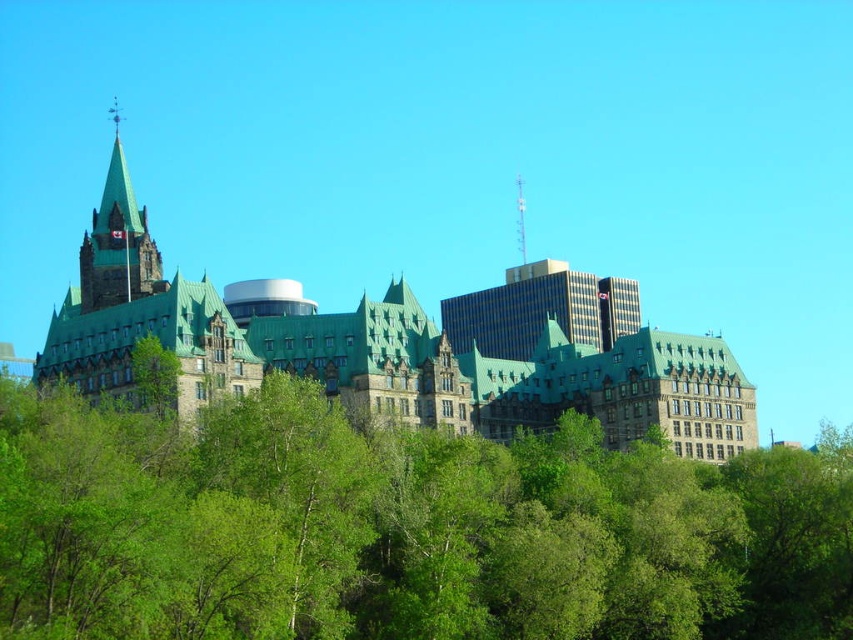
Does green leafy tree at center appear under shiny silver spire at upper center?

Yes, green leafy tree at center is below shiny silver spire at upper center.

What do you see at coordinates (399, 528) in the screenshot?
I see `green leafy tree at center` at bounding box center [399, 528].

Is point (502, 452) less distant than point (520, 237)?

Yes, point (502, 452) is in front of point (520, 237).

Locate an element on the screen. This screenshot has width=853, height=640. green leafy tree at center is located at coordinates (399, 528).

Which is behind, point (173, 323) or point (515, 188)?

Positioned behind is point (515, 188).

Can you confirm if green shingled castle at center is bigger than shiny silver spire at upper center?

Yes.

Does point (84, 307) come behind point (521, 188)?

No, it is in front of (521, 188).

The width and height of the screenshot is (853, 640). In order to click on green shingled castle at center in this screenshot , I will do `click(376, 352)`.

Who is taller, green leafy tree at center or dark brown stone tower at upper left?

Standing taller between the two is dark brown stone tower at upper left.

Does green leafy tree at center have a larger size compared to dark brown stone tower at upper left?

Yes, green leafy tree at center is bigger than dark brown stone tower at upper left.

Image resolution: width=853 pixels, height=640 pixels. Find the location of `green leafy tree at center`. green leafy tree at center is located at coordinates (399, 528).